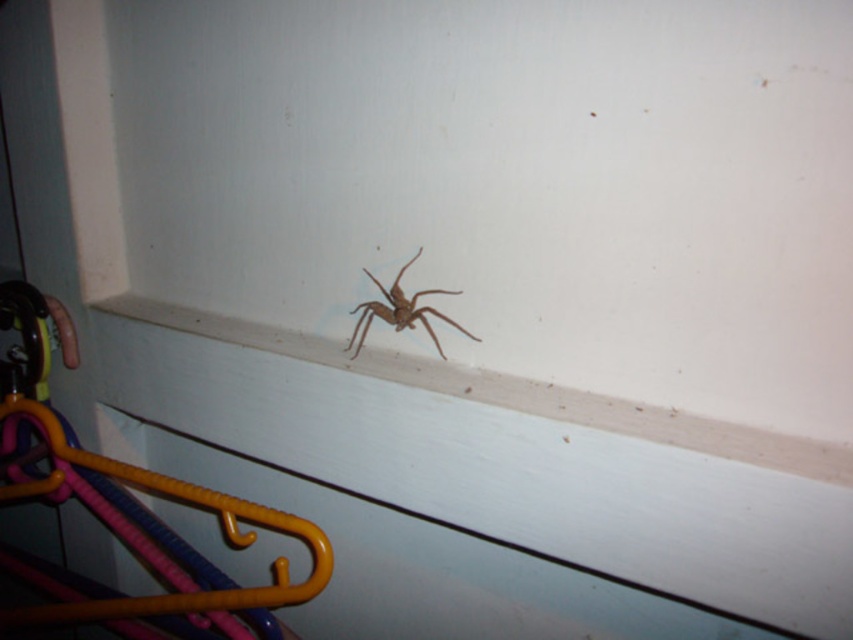
Can you confirm if white smooth window sill at center is wider than brown fuzzy spider at center?

Correct, the width of white smooth window sill at center exceeds that of brown fuzzy spider at center.

Does white smooth window sill at center appear over brown fuzzy spider at center?

No, white smooth window sill at center is not above brown fuzzy spider at center.

Measure the distance between white smooth window sill at center and camera.

The distance of white smooth window sill at center from camera is 78.71 centimeters.

At what (x,y) coordinates should I click in order to perform the action: click on white smooth window sill at center. Please return your answer as a coordinate pair (x, y). The image size is (853, 640). Looking at the image, I should click on (509, 392).

Which is above, orange plastic hanger at lower left or brown fuzzy spider at center?

Positioned higher is brown fuzzy spider at center.

Which is more to the left, orange plastic hanger at lower left or brown fuzzy spider at center?

orange plastic hanger at lower left

Measure the distance between point (22,304) and camera.

Point (22,304) and camera are 1.41 meters apart.

Identify the location of orange plastic hanger at lower left. The height and width of the screenshot is (640, 853). (129, 502).

Is orange plastic hanger at lower left below white smooth window sill at center?

Indeed, orange plastic hanger at lower left is positioned under white smooth window sill at center.

Looking at this image, does orange plastic hanger at lower left have a lesser height compared to white smooth window sill at center?

No, orange plastic hanger at lower left is not shorter than white smooth window sill at center.

What do you see at coordinates (129, 502) in the screenshot? I see `orange plastic hanger at lower left` at bounding box center [129, 502].

Where is `orange plastic hanger at lower left`? orange plastic hanger at lower left is located at coordinates (129, 502).